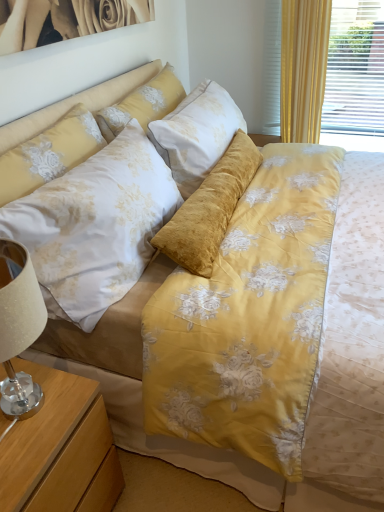
At what (x,y) coordinates should I click in order to perform the action: click on vacant space in white glossy picture frame at upper left (from a real-world perspective). Please return your answer as a coordinate pair (x, y). Looking at the image, I should click on (82, 80).